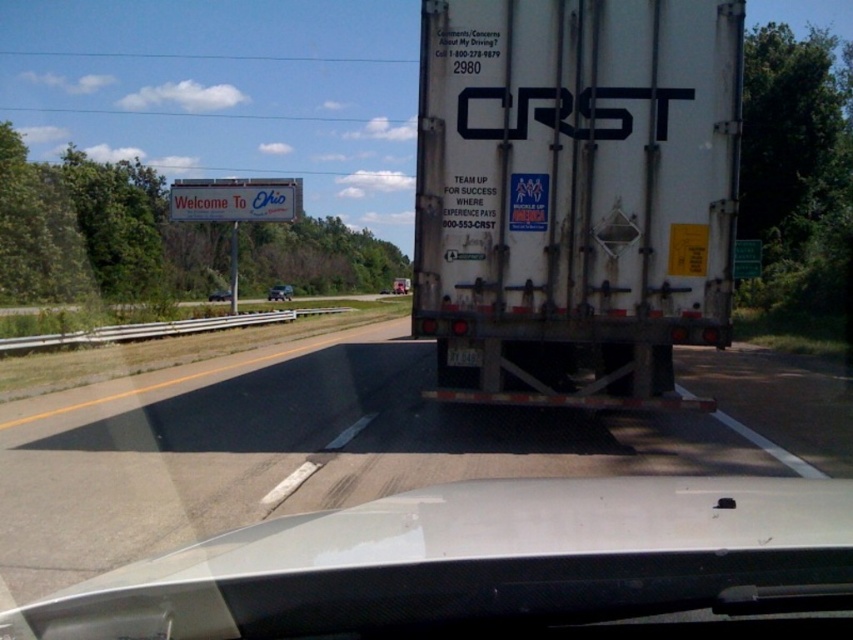
You are driving a car and want to overtake the white matte trailer truck at center. Based on the coordinates provided, can you estimate if there is enough space to safely overtake the truck on the highway?

The white matte trailer truck at center is located at coordinates point (575, 195). Since the highway has multi lanes, overtaking should be possible by moving into the adjacent lane, but always ensure safe distance and visibility before doing so.

You are driving a car and want to overtake the white matte trailer truck at center and the white matte train car at center on a highway. Which one can you pass more easily based on their widths?

The white matte trailer truck at center has a smaller width than the white matte train car at center, so it is easier to pass the white matte trailer truck at center since it occupies less space on the road.

You are driving a car and see both the white matte trailer truck at center and the white matte train car at center through your windshield. Which object is closer to your car?

The white matte trailer truck at center is closer to your car because it is further to the viewer than the white matte train car at center.